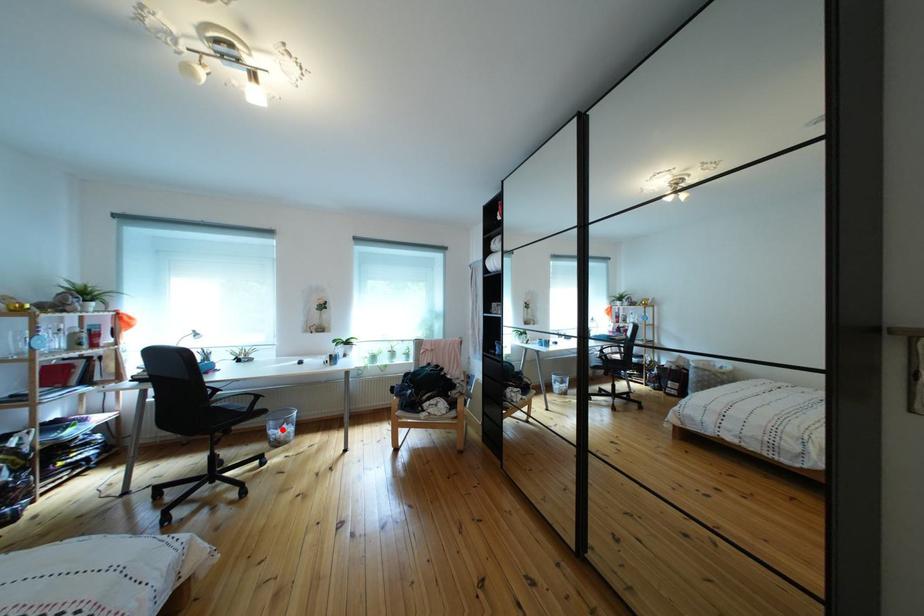
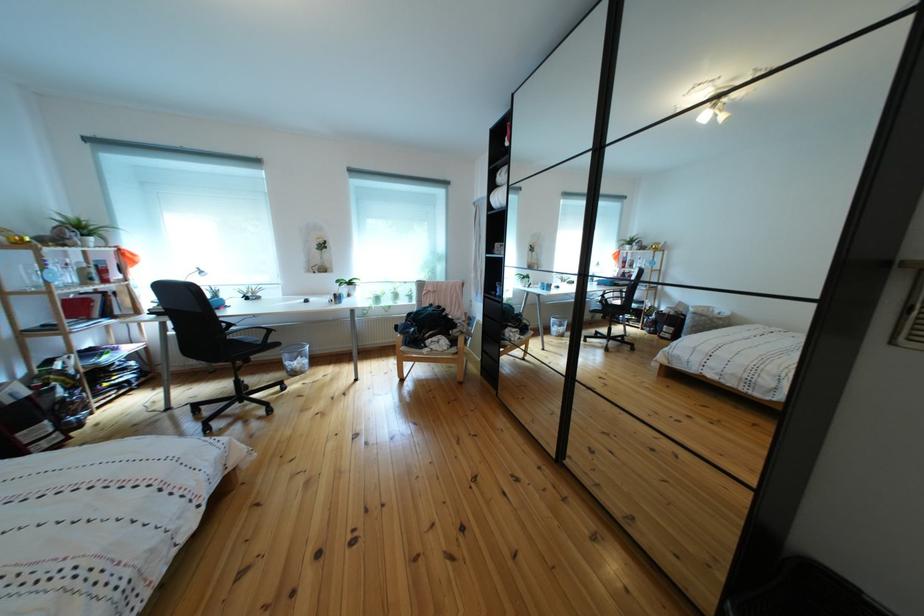
In the second image, find the point that corresponds to the highlighted location in the first image.

(297, 362)